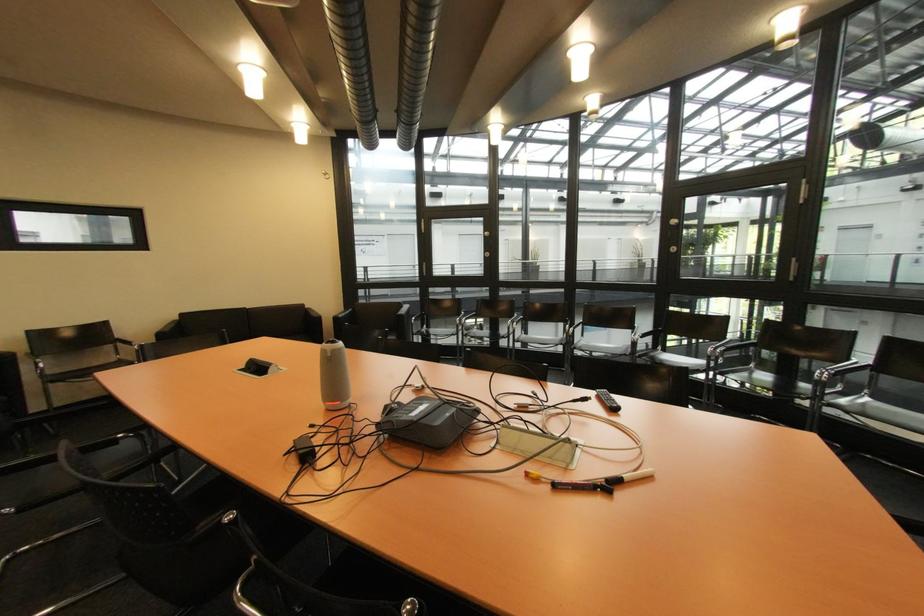
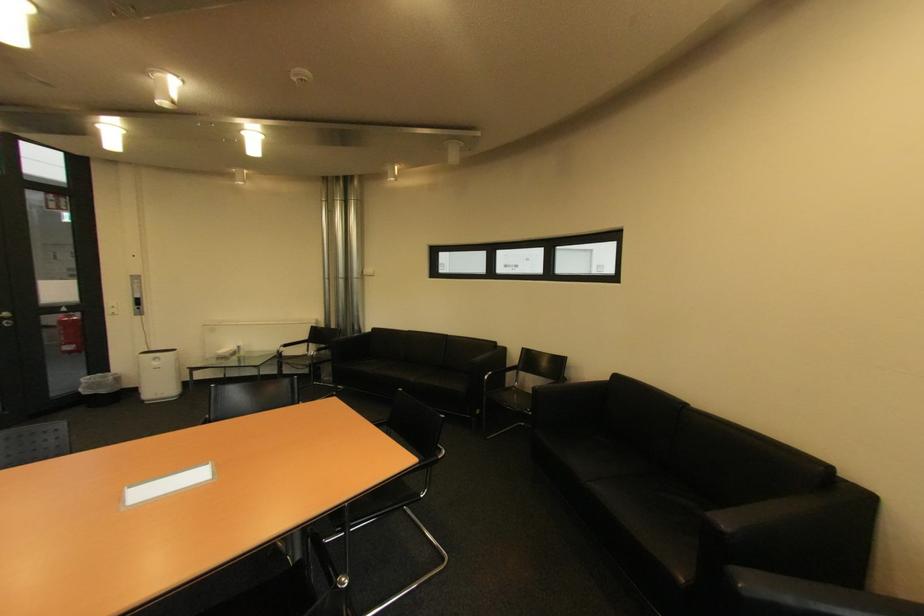
Locate, in the second image, the point that corresponds to pixel 189 315 in the first image.

(625, 378)